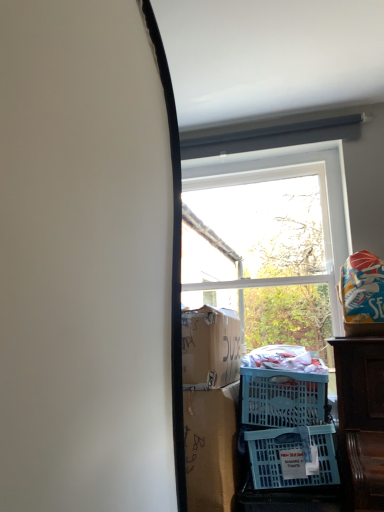
Question: In terms of size, does blue plastic basket at lower right appear bigger or smaller than transparent glass window at center?

Choices:
 (A) big
 (B) small

Answer: (B)

Question: From the image's perspective, is blue plastic basket at lower right above or below transparent glass window at center?

Choices:
 (A) below
 (B) above

Answer: (A)

Question: From a real-world perspective, is blue plastic basket at lower right positioned above or below transparent glass window at center?

Choices:
 (A) below
 (B) above

Answer: (A)

Question: From the image's perspective, is transparent glass window at center above or below blue plastic basket at lower right?

Choices:
 (A) below
 (B) above

Answer: (B)

Question: Is transparent glass window at center spatially inside blue plastic basket at lower right, or outside of it?

Choices:
 (A) inside
 (B) outside

Answer: (B)

Question: From a real-world perspective, is transparent glass window at center positioned above or below blue plastic basket at lower right?

Choices:
 (A) below
 (B) above

Answer: (B)

Question: Is point (264, 297) closer or farther from the camera than point (312, 429)?

Choices:
 (A) farther
 (B) closer

Answer: (A)